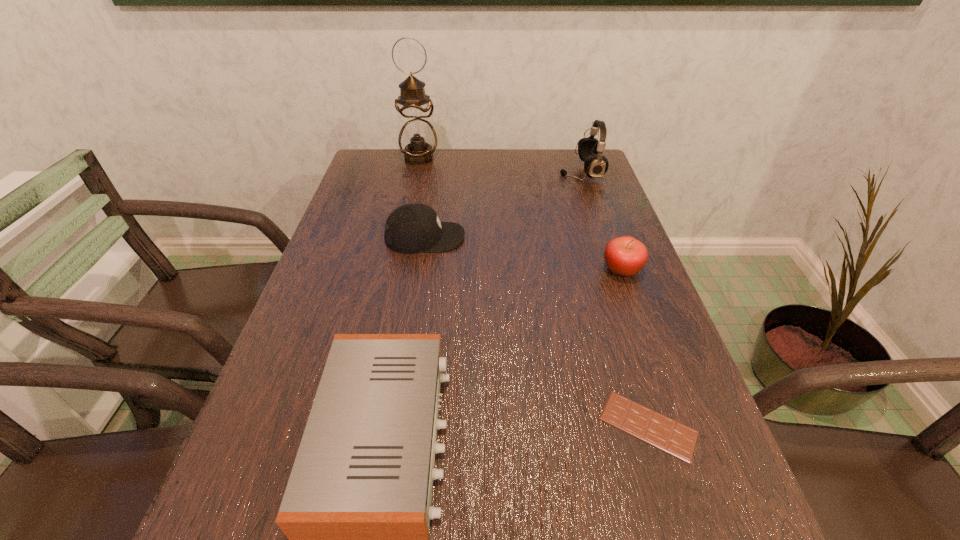
Find the location of a particular element. The width and height of the screenshot is (960, 540). object that is at the far right corner is located at coordinates (590, 150).

Where is `free spot at the far edge of the desktop`? This screenshot has width=960, height=540. free spot at the far edge of the desktop is located at coordinates (529, 158).

The height and width of the screenshot is (540, 960). Find the location of `free space at the left edge`. free space at the left edge is located at coordinates (342, 218).

Where is `free space at the right edge of the desktop`? This screenshot has width=960, height=540. free space at the right edge of the desktop is located at coordinates (642, 301).

Locate an element on the screen. This screenshot has height=540, width=960. vacant region at the far left corner of the desktop is located at coordinates (373, 172).

Locate an element on the screen. The image size is (960, 540). vacant space at the far right corner of the desktop is located at coordinates (564, 155).

Identify the location of blank region between the headset and the cap. Image resolution: width=960 pixels, height=540 pixels. (503, 205).

Locate an element on the screen. This screenshot has width=960, height=540. vacant area between the cap and the tallest object is located at coordinates (422, 198).

You are a GUI agent. You are given a task and a screenshot of the screen. Output one action in this format:
    pyautogui.click(x=<x>, y=<y>)
    Task: Click on the blank region between the chocolate bar and the cap
    The width and height of the screenshot is (960, 540).
    Given the screenshot: What is the action you would take?
    pyautogui.click(x=537, y=332)

Where is `free spot between the chocolate bar and the headset`? free spot between the chocolate bar and the headset is located at coordinates (614, 299).